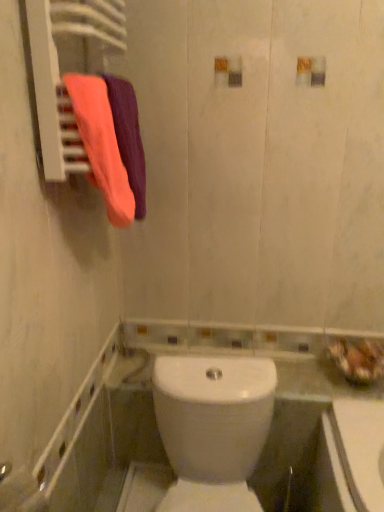
Question: Would you say orange cotton towel at upper left, which is counted as the 1th bath towel, starting from the back, is to the left or to the right of matte pink towel at left, the 2th bath towel from the back, in the picture?

Choices:
 (A) right
 (B) left

Answer: (A)

Question: Considering the positions of orange cotton towel at upper left, which is counted as the 1th bath towel, starting from the back, and matte pink towel at left, the 2th bath towel from the back, in the image, is orange cotton towel at upper left, which is counted as the 1th bath towel, starting from the back, taller or shorter than matte pink towel at left, the 2th bath towel from the back,?

Choices:
 (A) short
 (B) tall

Answer: (B)

Question: Estimate the real-world distances between objects in this image. Which object is closer to the orange cotton towel at upper left, the second bath towel positioned from the front?

Choices:
 (A) white glossy toilet at center
 (B) matte pink towel at left, the 1th bath towel in the front-to-back sequence

Answer: (B)

Question: Considering the real-world distances, which object is farthest from the matte pink towel at left, the 1th bath towel in the front-to-back sequence?

Choices:
 (A) orange cotton towel at upper left, the second bath towel positioned from the front
 (B) white glossy toilet at center

Answer: (B)